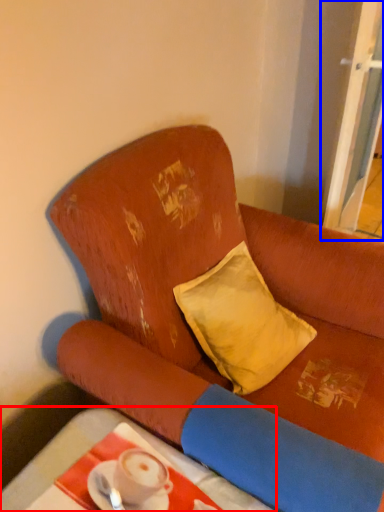
Question: Among these objects, which one is farthest to the camera, table (highlighted by a red box) or screen door (highlighted by a blue box)?

Choices:
 (A) table
 (B) screen door

Answer: (B)